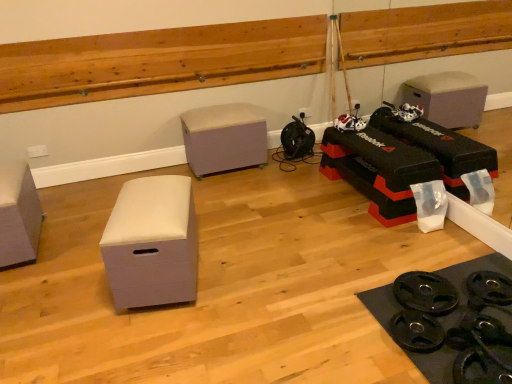
Question: Do you think white matte storage box at center-left, the 3th furniture in the back-to-front sequence, is within matte gray storage box at left, the second furniture when ordered from front to back, or outside of it?

Choices:
 (A) outside
 (B) inside

Answer: (A)

Question: From the image's perspective, is white matte storage box at center-left, which is the 1th furniture from front to back, located above or below matte gray storage box at left, placed as the first furniture when sorted from left to right?

Choices:
 (A) above
 (B) below

Answer: (B)

Question: Based on their relative distances, which object is farther from the beige fabric ottoman at center, the 3th furniture positioned from the front?

Choices:
 (A) wooden ledge at upper center
 (B) white matte storage box at center-left, which is counted as the 2th furniture, starting from the right
 (C) matte gray storage box at left, which is counted as the 2th furniture, starting from the back

Answer: (C)

Question: Estimate the real-world distances between objects in this image. Which object is closer to the matte gray storage box at left, which is counted as the 2th furniture, starting from the back?

Choices:
 (A) beige fabric ottoman at center, which is counted as the 1th furniture, starting from the right
 (B) white matte storage box at center-left, the 3th furniture in the back-to-front sequence
 (C) wooden ledge at upper center

Answer: (B)